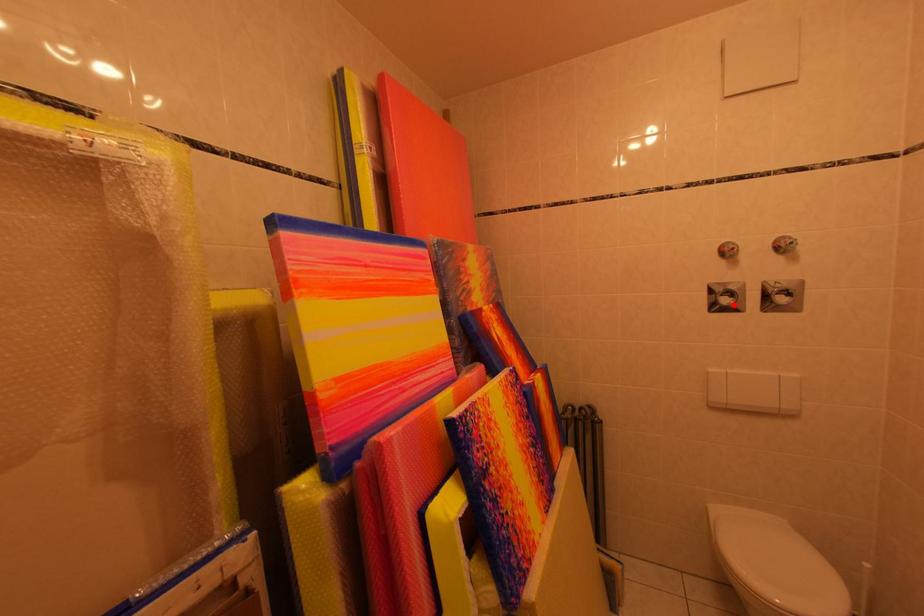
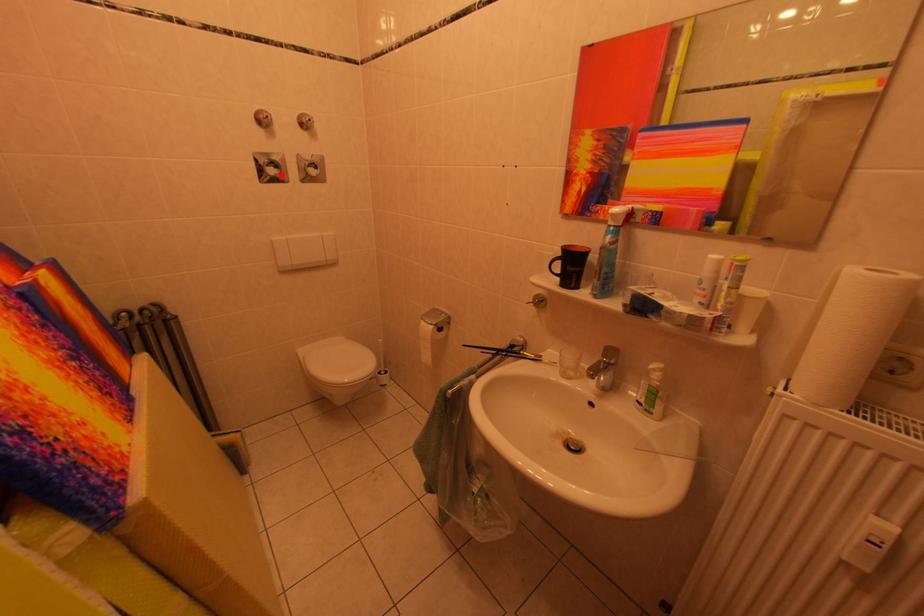
I am providing you with two images of the same scene from different viewpoints. A red point is marked on the first image and another point is marked on the second image. Is the marked point in image1 the same physical position as the marked point in image2?

Yes